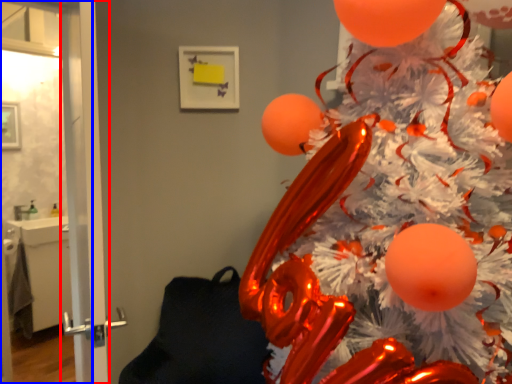
Question: Which object appears closest to the camera in this image, screen door (highlighted by a red box) or screen door (highlighted by a blue box)?

Choices:
 (A) screen door
 (B) screen door

Answer: (A)